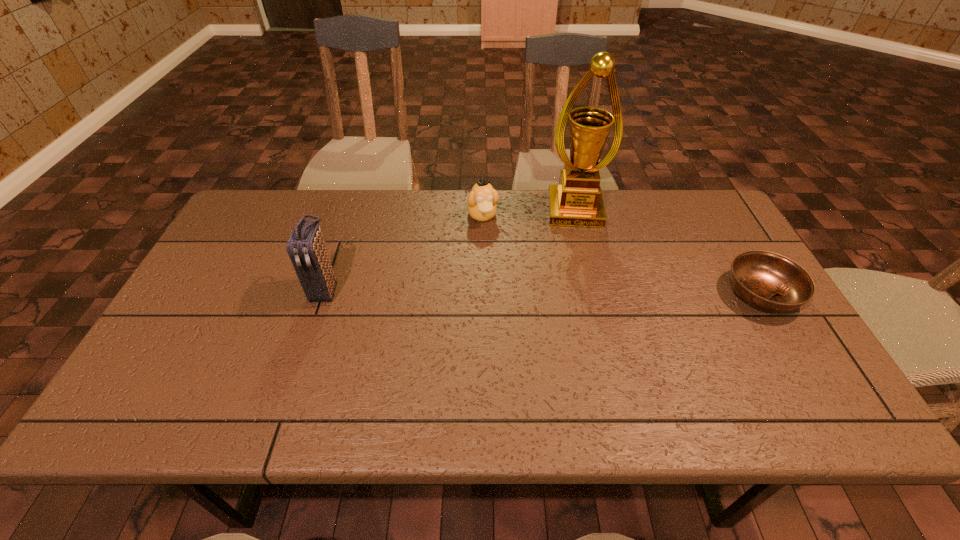
This screenshot has height=540, width=960. In order to click on blank area in the image that satisfies the following two spatial constraints: 1. with the zip open on the second tallest object; 2. on the right side of the rightmost object in this screenshot , I will do `click(324, 293)`.